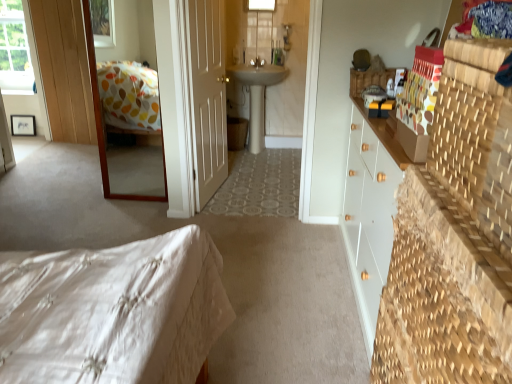
Locate an element on the screen. free point behind wooden-framed mirror at upper left is located at coordinates (136, 190).